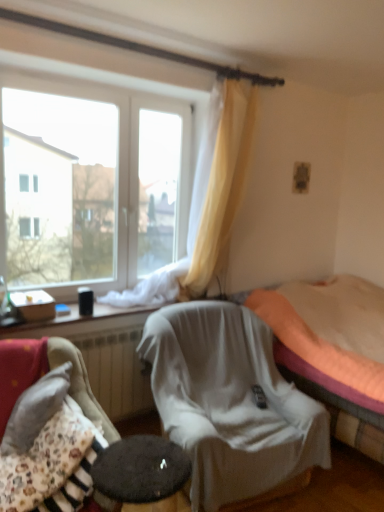
Question: Is point (82, 381) positioned closer to the camera than point (13, 202)?

Choices:
 (A) closer
 (B) farther

Answer: (A)

Question: From the image's perspective, is floral fabric cushion at lower left, placed as the first chair when sorted from front to back, positioned above or below transparent glass window at upper left, arranged as the first window when viewed from the top?

Choices:
 (A) below
 (B) above

Answer: (A)

Question: Which of these objects is positioned farthest from the white fabric chair at center, arranged as the 2th chair when viewed from the front?

Choices:
 (A) transparent plastic container at lower left, placed as the 1th window when sorted from bottom to top
 (B) floral fabric cushion at lower left, placed as the first chair when sorted from front to back
 (C) transparent glass window at upper left, arranged as the first window when viewed from the top
 (D) black plastic remote control at center
 (E) orange fabric bed at center

Answer: (C)

Question: Estimate the real-world distances between objects in this image. Which object is farther from the transparent plastic container at lower left, arranged as the second window when viewed from the top?

Choices:
 (A) orange fabric bed at center
 (B) black plastic remote control at center
 (C) transparent glass window at upper left, the 2th window ordered from the bottom
 (D) floral fabric cushion at lower left, placed as the first chair when sorted from front to back
 (E) white fabric chair at center, which appears as the first chair when viewed from the back

Answer: (A)